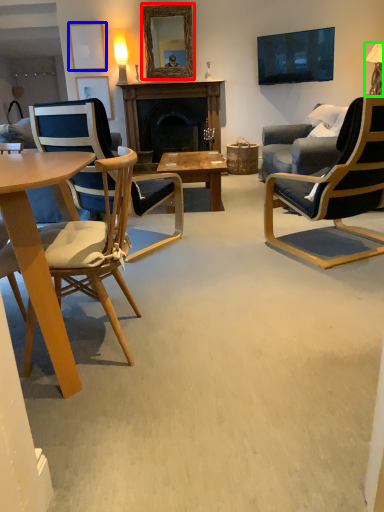
Question: Estimate the real-world distances between objects in this image. Which object is farther from mirror (highlighted by a red box), picture frame (highlighted by a blue box) or lamp (highlighted by a green box)?

Choices:
 (A) picture frame
 (B) lamp

Answer: (B)